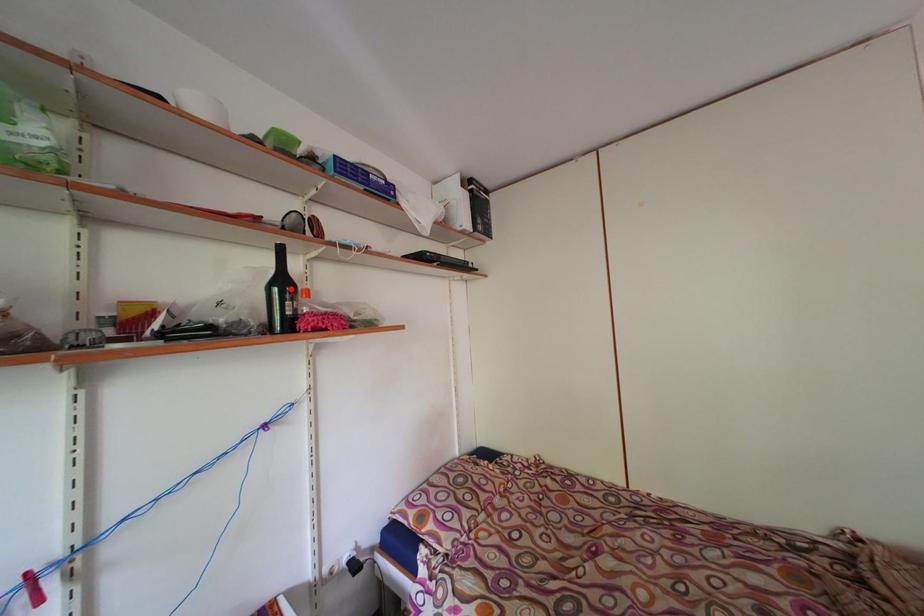
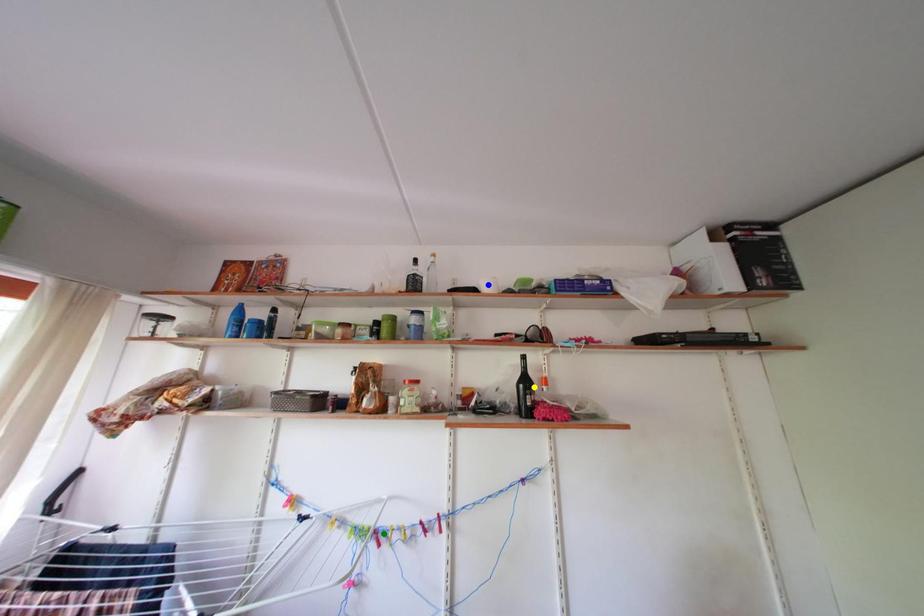
Question: I am providing you with two images of the same scene from different viewpoints. A red point is marked on the first image. You are given multiple points on the second image. Which spot in image 2 lines up with the point in image 1?

Choices:
 (A) yellow point
 (B) blue point
 (C) green point

Answer: (A)